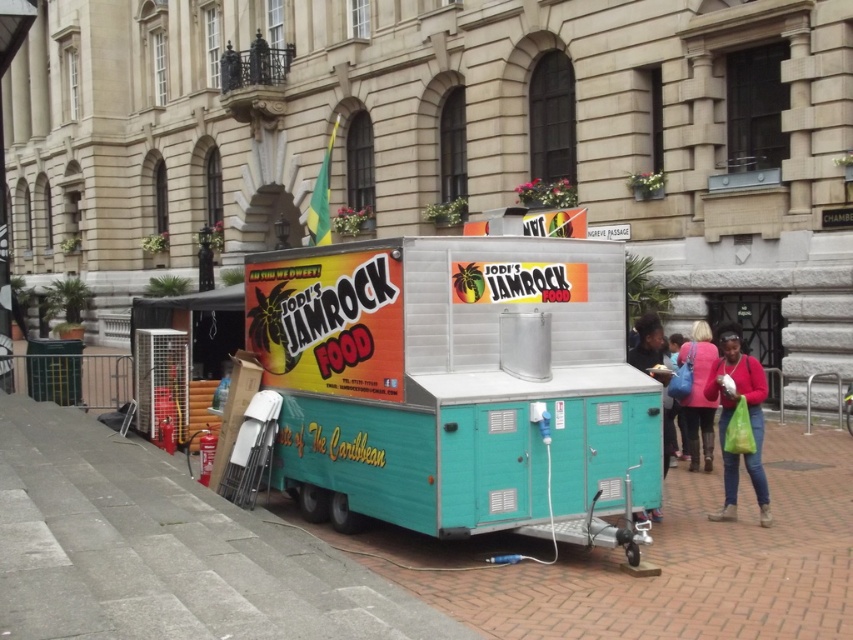
Question: Does teal matte food truck at center appear under matte pink jacket at center?

Choices:
 (A) yes
 (B) no

Answer: (B)

Question: Considering the real-world distances, which object is farthest from the matte pink jacket at center?

Choices:
 (A) matte pink sweater at lower right
 (B) teal plastic food cart at right
 (C) teal matte food truck at center

Answer: (C)

Question: Which object is the closest to the matte pink sweater at lower right?

Choices:
 (A) teal matte food truck at center
 (B) matte pink jacket at center
 (C) teal plastic food cart at right

Answer: (C)

Question: Is matte pink jacket at center to the right of teal plastic food cart at right from the viewer's perspective?

Choices:
 (A) yes
 (B) no

Answer: (A)

Question: Is matte pink sweater at lower right below matte pink jacket at center?

Choices:
 (A) no
 (B) yes

Answer: (B)

Question: Which point is closer to the camera?

Choices:
 (A) (735, 394)
 (B) (639, 369)

Answer: (A)